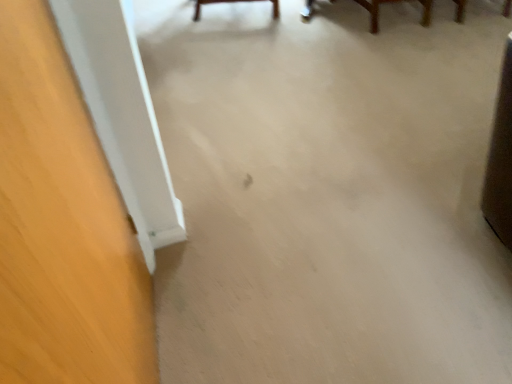
Locate an element on the screen. This screenshot has height=384, width=512. wooden floor at left is located at coordinates (62, 226).

This screenshot has width=512, height=384. What do you see at coordinates (62, 226) in the screenshot?
I see `wooden floor at left` at bounding box center [62, 226].

This screenshot has width=512, height=384. What are the coordinates of `wooden floor at left` in the screenshot? It's located at (62, 226).